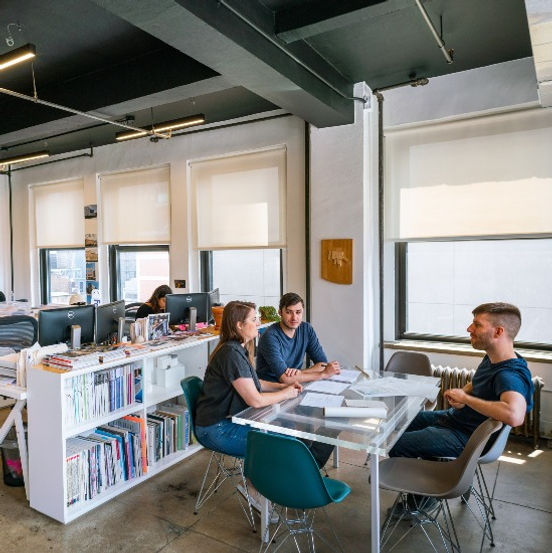
Find the location of a particular element. The image size is (552, 553). books is located at coordinates (115, 457), (179, 438), (92, 390), (118, 388).